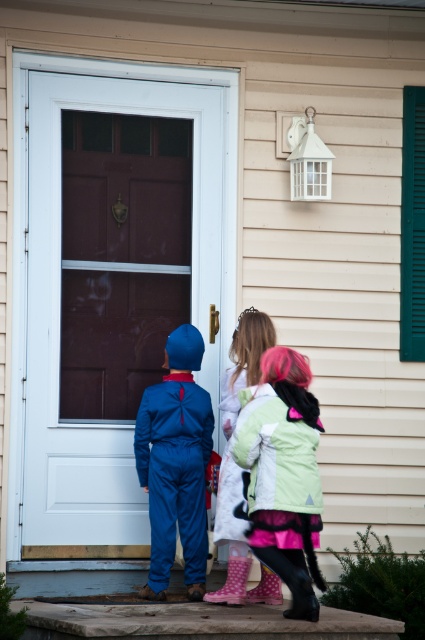
Question: Estimate the real-world distances between objects in this image. Which object is closer to the matte brown screen door at center?

Choices:
 (A) blue matte jumpsuit at center
 (B) light pink polka dot boots at center
 (C) light green fleece jacket at center

Answer: (A)

Question: From the image, what is the correct spatial relationship of light green fleece jacket at center in relation to light pink polka dot boots at center?

Choices:
 (A) left
 (B) right

Answer: (B)

Question: Is light green fleece jacket at center above blue matte jumpsuit at center?

Choices:
 (A) no
 (B) yes

Answer: (A)

Question: Observing the image, what is the correct spatial positioning of blue matte jumpsuit at center in reference to light pink polka dot boots at center?

Choices:
 (A) above
 (B) below

Answer: (B)

Question: Which object appears farthest from the camera in this image?

Choices:
 (A) blue matte jumpsuit at center
 (B) matte brown screen door at center
 (C) light pink polka dot boots at center

Answer: (B)

Question: Among these objects, which one is farthest from the camera?

Choices:
 (A) light pink polka dot boots at center
 (B) blue matte jumpsuit at center
 (C) matte brown screen door at center
 (D) light green fleece jacket at center

Answer: (C)